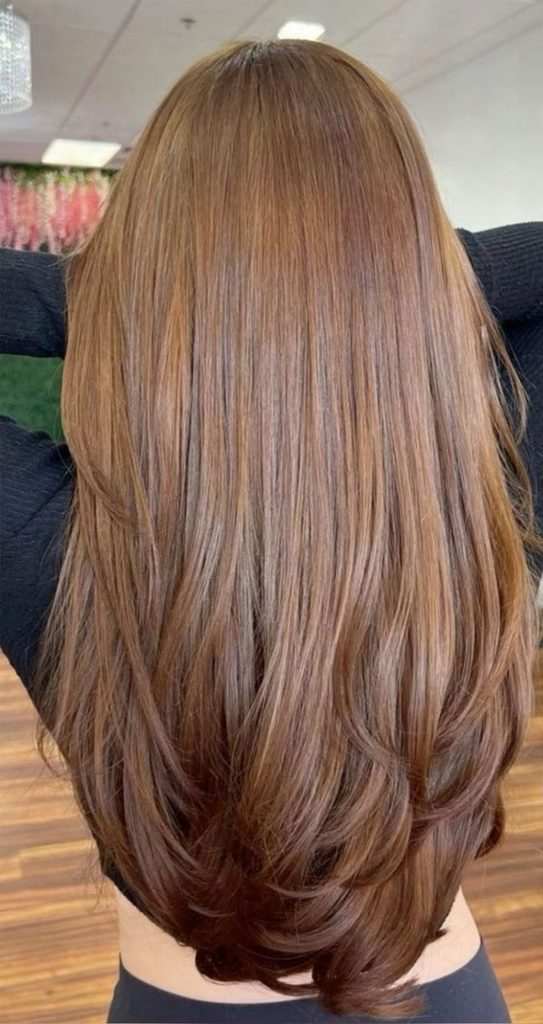
Image resolution: width=543 pixels, height=1024 pixels. Find the location of `brown hardwood flooring`. brown hardwood flooring is located at coordinates coord(40,867), coord(519,854).